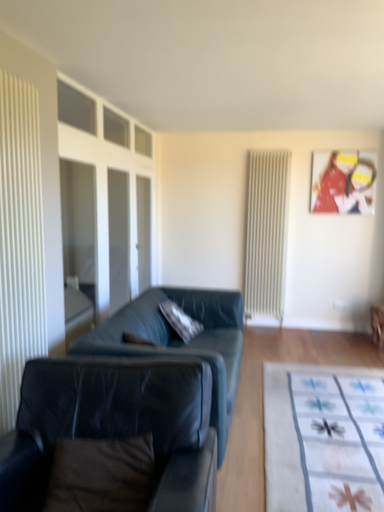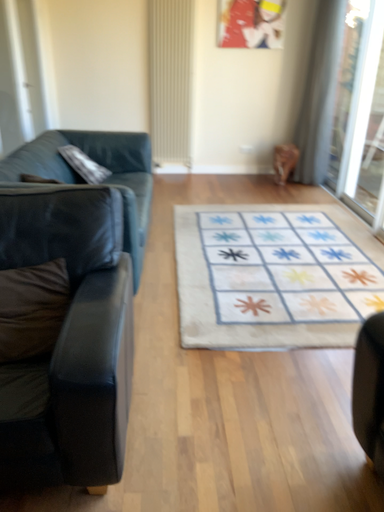
Question: How did the camera likely rotate when shooting the video?

Choices:
 (A) rotated upward
 (B) rotated downward

Answer: (B)